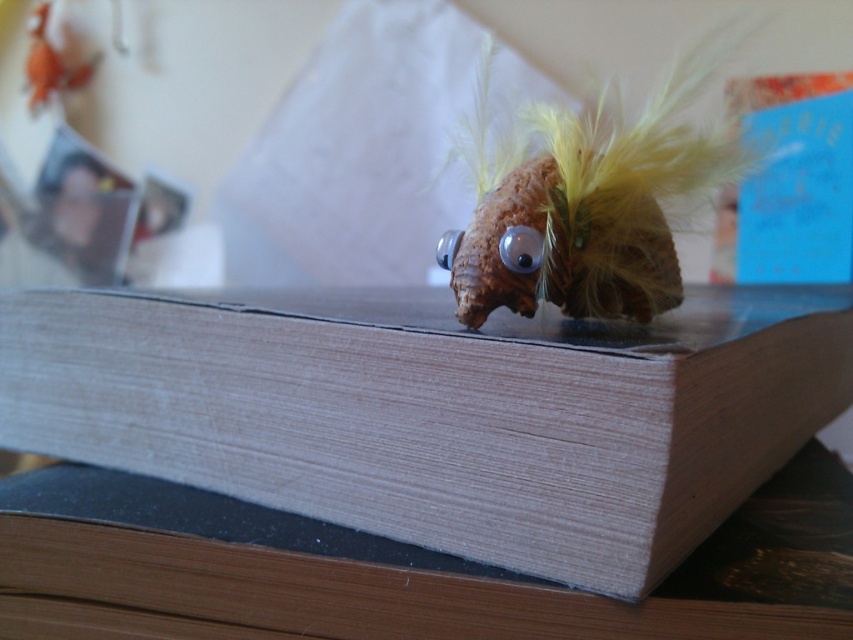
You are organizing a shelf and need to place the wooden paperback book at center and the fuzzy brown snail at center next to each other. Which one should you place first if you want to ensure they both fit without overlapping?

The wooden paperback book at center is wider than the fuzzy brown snail at center, so you should place the wider book first to ensure there is enough space for both items on the shelf.

Consider the image. Where is the wooden paperback book at center located in the image?

The wooden paperback book at center is located at point coordinates of (440, 412).

Looking at this image, what is located at the point with coordinates (x=583, y=202) in the image?

The point with coordinates (x=583, y=202) indicates the location of the fuzzy brown snail at center.